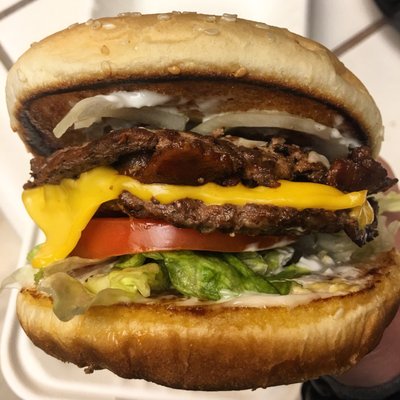
You are a GUI agent. You are given a task and a screenshot of the screen. Output one action in this format:
    pyautogui.click(x=<x>, y=<y>)
    Task: Click on the white plate
    The image size is (400, 400).
    Given the screenshot: What is the action you would take?
    pyautogui.click(x=27, y=359)